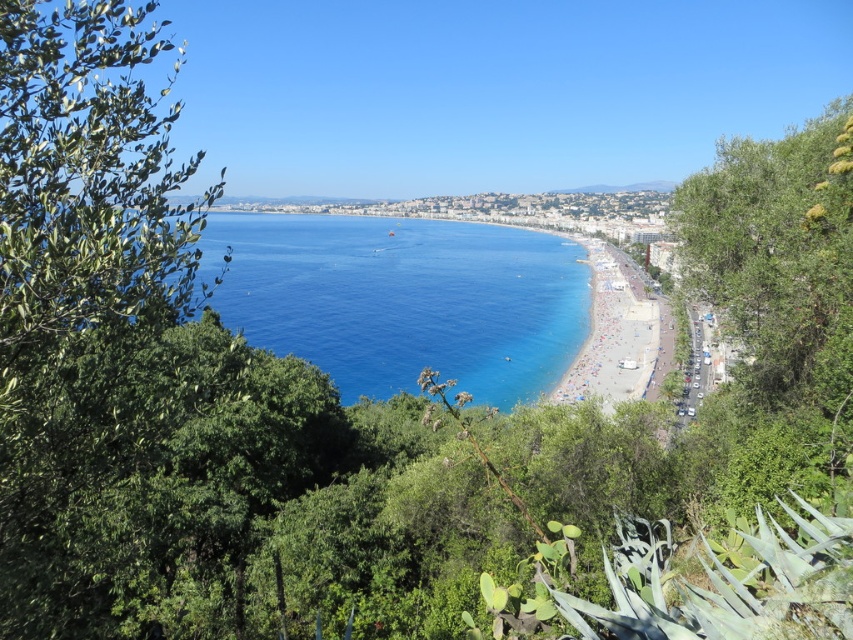
You are standing at the edge of the beach in the coastal scene. If you want to reach the blue liquid water at center, in which direction should you move relative to your current position?

The blue liquid water at center is located at point (402, 300), so you should move forward towards the center of the image to reach it.

Based on the photo, you are standing at the center of the beach in the image. Which direction should you walk to reach the green leafy tree at left?

The green leafy tree at left is located at the left side of the image, so you should walk to your left to reach it.

You are standing at the point closer to the camera in the image. Which point should you move towards to reach the beach area first? The options are point A at point (x=49, y=102) or point B at point (x=651, y=355).

Point A at point (x=49, y=102) is closer to the camera, so moving towards it would lead you closer to the beach area first.